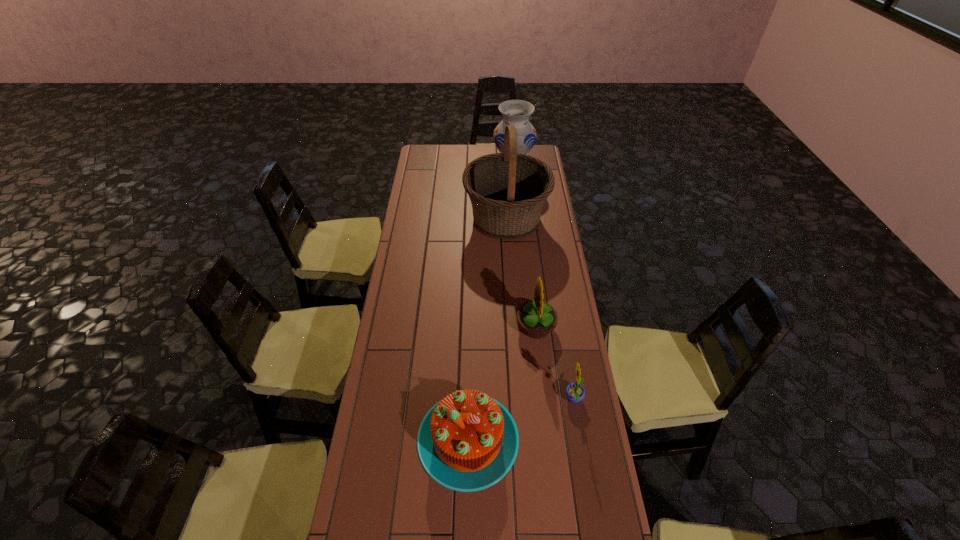
This screenshot has width=960, height=540. Find the location of `vacant space located 0.170m on the face of the third nearest object`. vacant space located 0.170m on the face of the third nearest object is located at coordinates (472, 326).

I want to click on vacant region located 0.290m on the face of the third nearest object, so click(x=442, y=326).

The width and height of the screenshot is (960, 540). Find the location of `free space located on the face of the third nearest object`. free space located on the face of the third nearest object is located at coordinates (488, 326).

Where is `vacant space situated on the front-facing side of the nearer sunflower`? Image resolution: width=960 pixels, height=540 pixels. vacant space situated on the front-facing side of the nearer sunflower is located at coordinates (473, 400).

This screenshot has height=540, width=960. I want to click on blank space located 0.250m on the front-facing side of the nearer sunflower, so click(x=491, y=400).

Where is `vacant region located 0.240m on the front-facing side of the nearer sunflower`? vacant region located 0.240m on the front-facing side of the nearer sunflower is located at coordinates (493, 400).

At what (x,y) coordinates should I click in order to perform the action: click on vacant space located on the back of the cake. Please return your answer as a coordinate pair (x, y). This screenshot has height=540, width=960. Looking at the image, I should click on (469, 349).

Identify the location of object that is at the far edge. (515, 112).

Identify the location of basket that is positioned at the right edge. (508, 190).

Where is `vase at the right edge`? vase at the right edge is located at coordinates (515, 112).